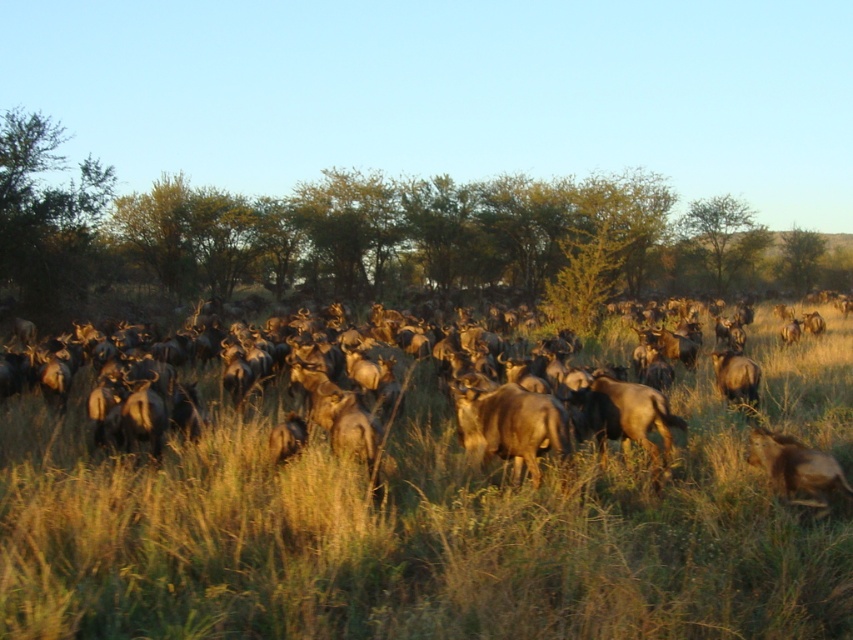
Question: Among these points, which one is farthest from the camera?

Choices:
 (A) (798, 472)
 (B) (560, 410)
 (C) (726, 364)

Answer: (C)

Question: Which of the following is the closest to the observer?

Choices:
 (A) brown grassy at center
 (B) brown furry buffalo at center-right

Answer: (A)

Question: Can you confirm if brown grassy at center is thinner than brown furry antelope at lower right?

Choices:
 (A) no
 (B) yes

Answer: (A)

Question: Is brown grassy at center to the left of brown furry antelope at lower right from the viewer's perspective?

Choices:
 (A) yes
 (B) no

Answer: (A)

Question: Does brown grassy at center have a greater width compared to brown furry antelope at lower right?

Choices:
 (A) yes
 (B) no

Answer: (A)

Question: Which point is closer to the camera taking this photo?

Choices:
 (A) (393, 557)
 (B) (813, 497)
 (C) (520, 445)
 (D) (727, 356)

Answer: (A)